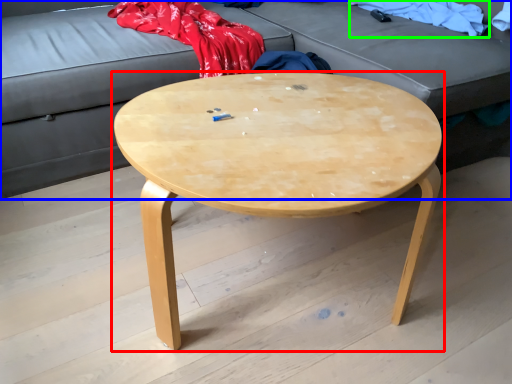
Question: Which object is positioned closest to coffee table (highlighted by a red box)? Select from studio couch (highlighted by a blue box) and clothing (highlighted by a green box).

Choices:
 (A) studio couch
 (B) clothing

Answer: (A)